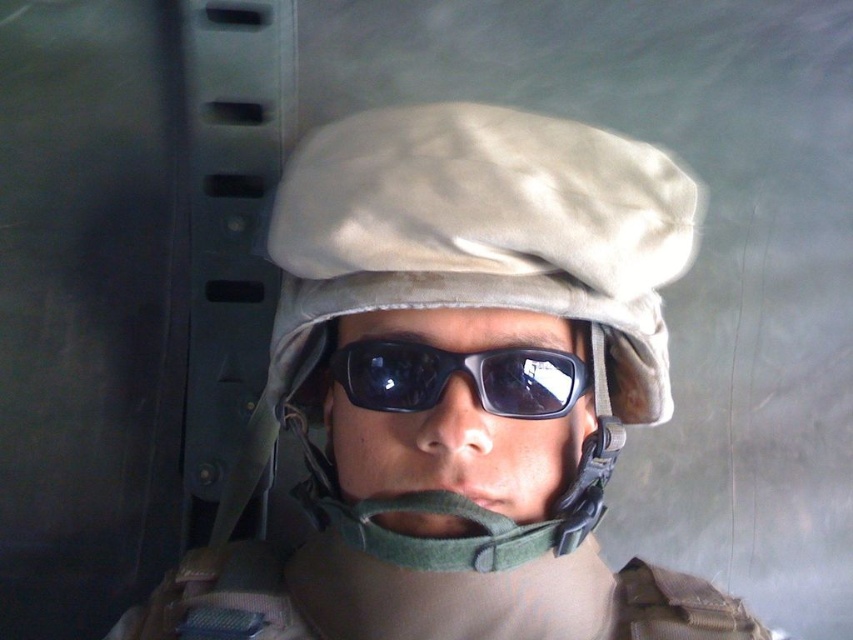
Question: Among these objects, which one is farthest from the camera?

Choices:
 (A) tan fabric helmet at center
 (B) black matte sunglasses at center

Answer: (B)

Question: Is tan fabric helmet at center further to the viewer compared to black matte sunglasses at center?

Choices:
 (A) no
 (B) yes

Answer: (A)

Question: Which point is closer to the camera taking this photo?

Choices:
 (A) (525, 138)
 (B) (428, 394)

Answer: (B)

Question: Is tan fabric helmet at center to the right of black matte sunglasses at center from the viewer's perspective?

Choices:
 (A) no
 (B) yes

Answer: (B)

Question: Does tan fabric helmet at center appear over black matte sunglasses at center?

Choices:
 (A) yes
 (B) no

Answer: (A)